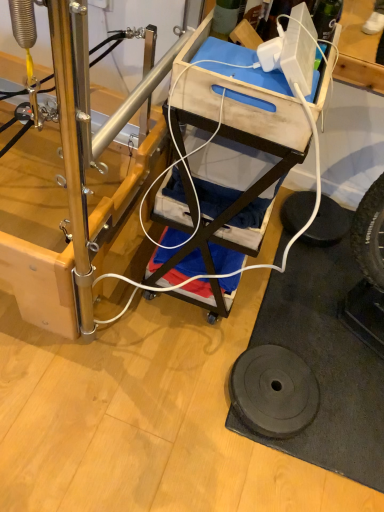
Question: Considering the positions of black rubber tire at lower right and black rubber weight at lower right in the image, is black rubber tire at lower right bigger or smaller than black rubber weight at lower right?

Choices:
 (A) small
 (B) big

Answer: (A)

Question: Looking at their shapes, would you say black rubber tire at lower right is wider or thinner than black rubber weight at lower right?

Choices:
 (A) thin
 (B) wide

Answer: (A)

Question: Which of these objects is positioned farthest from the black rubber tire at lower right?

Choices:
 (A) black rubber weight at lower right
 (B) wooden cart at center

Answer: (B)

Question: Considering the real-world distances, which object is closest to the black rubber weight at lower right?

Choices:
 (A) wooden cart at center
 (B) black rubber tire at lower right

Answer: (A)